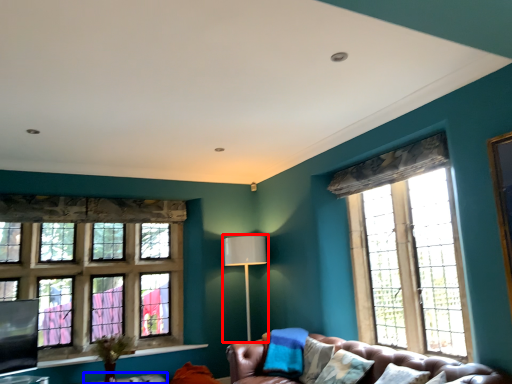
Question: Among these objects, which one is nearest to the camera, lamp (highlighted by a red box) or table (highlighted by a blue box)?

Choices:
 (A) lamp
 (B) table

Answer: (B)